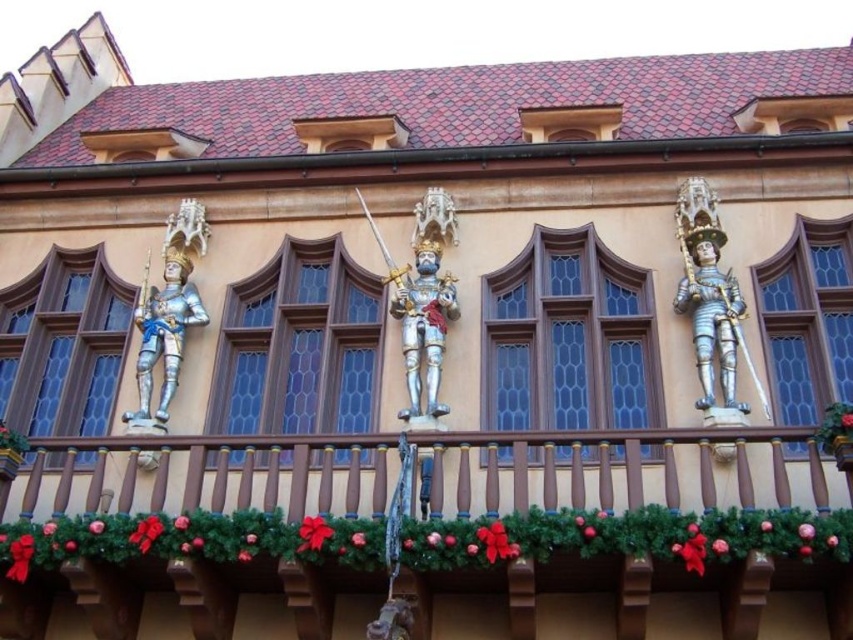
You are standing in front of the building and want to touch both the brown wooden railing at center and the blue metallic knight at center. Which object will you reach first?

You will reach the brown wooden railing at center first because it is closer to the viewer than the blue metallic knight at center.